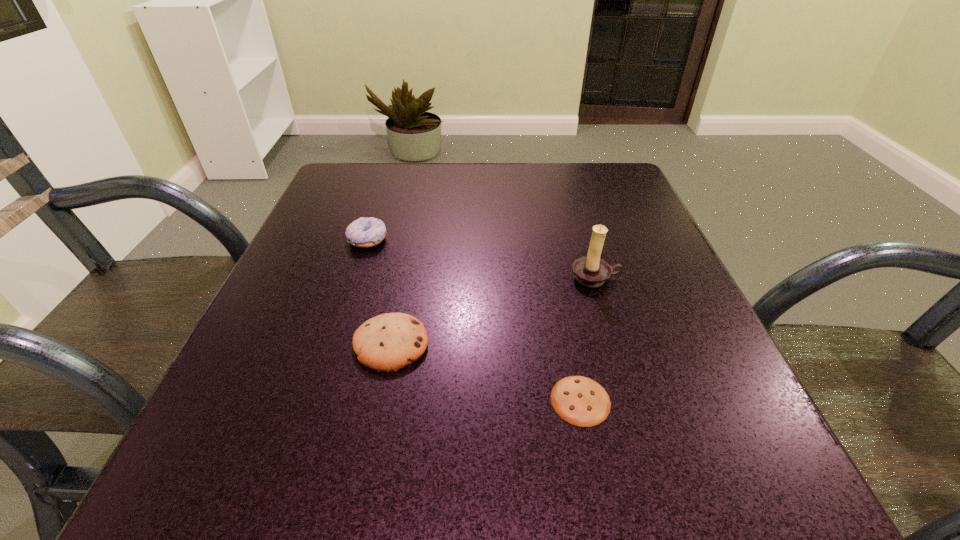
This screenshot has width=960, height=540. Identify the location of vacant space situated on the left of the right cookie. (493, 400).

Where is `object that is at the left edge`? object that is at the left edge is located at coordinates (366, 232).

Find the location of `object that is positioned at the right edge`. object that is positioned at the right edge is located at coordinates (591, 271).

Image resolution: width=960 pixels, height=540 pixels. I want to click on vacant area at the far edge of the desktop, so (466, 161).

Find the location of a particular element. The width and height of the screenshot is (960, 540). free space at the near edge of the desktop is located at coordinates (535, 444).

You are a GUI agent. You are given a task and a screenshot of the screen. Output one action in this format:
    pyautogui.click(x=<x>, y=<y>)
    Task: Click on the free location at the left edge of the desktop
    This screenshot has height=540, width=960.
    Given the screenshot: What is the action you would take?
    pyautogui.click(x=279, y=417)

This screenshot has width=960, height=540. What are the coordinates of `free location at the right edge` in the screenshot? It's located at (646, 237).

The width and height of the screenshot is (960, 540). In the image, there is a desktop. Identify the location of free region at the far left corner. (377, 211).

Locate an element on the screen. vacant space at the far right corner of the desktop is located at coordinates (589, 176).

Identify the location of free area in between the candle holder and the shorter cookie. The image size is (960, 540). (588, 339).